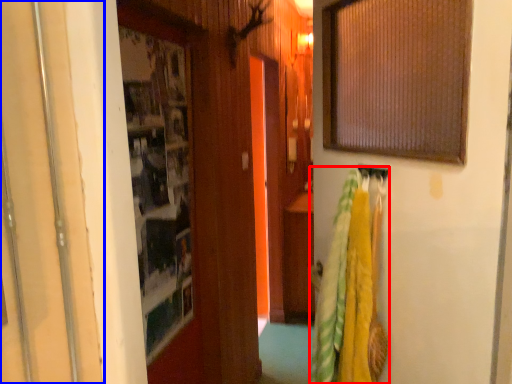
Question: Which of the following is the closest to the observer, laundry (highlighted by a red box) or door (highlighted by a blue box)?

Choices:
 (A) laundry
 (B) door

Answer: (B)